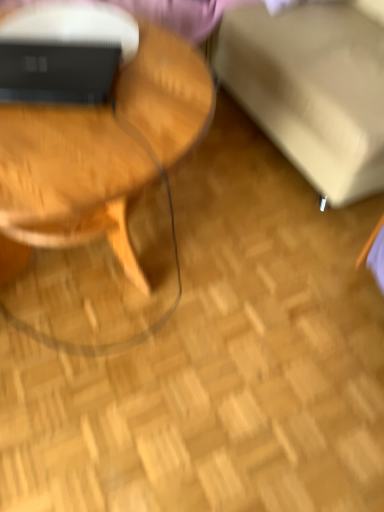
Where is `vacant area that is situated to the right of matte black laptop at upper left`? The image size is (384, 512). vacant area that is situated to the right of matte black laptop at upper left is located at coordinates (148, 102).